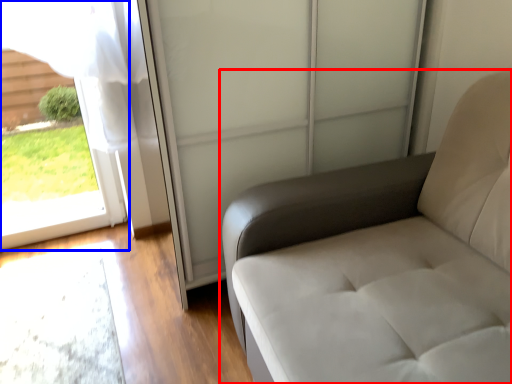
Question: Which point is further to the camera, furniture (highlighted by a red box) or window (highlighted by a blue box)?

Choices:
 (A) furniture
 (B) window

Answer: (B)